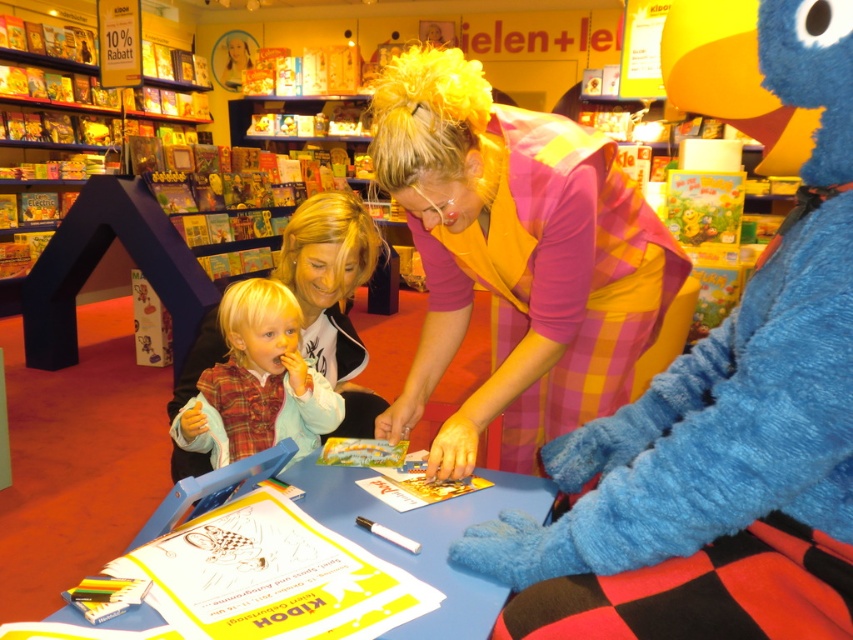
Question: Which of the following is the farthest from the observer?

Choices:
 (A) (241, 333)
 (B) (758, 548)
 (C) (445, 218)

Answer: (A)

Question: Does blue fuzzy glove at center have a greater width compared to plaid wool sweater at lower left?

Choices:
 (A) no
 (B) yes

Answer: (B)

Question: Considering the real-world distances, which object is farthest from the plaid wool sweater at lower left?

Choices:
 (A) blue fuzzy glove at center
 (B) plaid fabric shirt at center

Answer: (A)

Question: Is blue fuzzy glove at center bigger than plaid wool sweater at lower left?

Choices:
 (A) yes
 (B) no

Answer: (A)

Question: Can you confirm if blue fuzzy glove at center is positioned to the right of plaid fabric shirt at center?

Choices:
 (A) no
 (B) yes

Answer: (B)

Question: Which point is closer to the camera taking this photo?

Choices:
 (A) (848, 152)
 (B) (480, 177)
 (C) (216, 433)

Answer: (A)